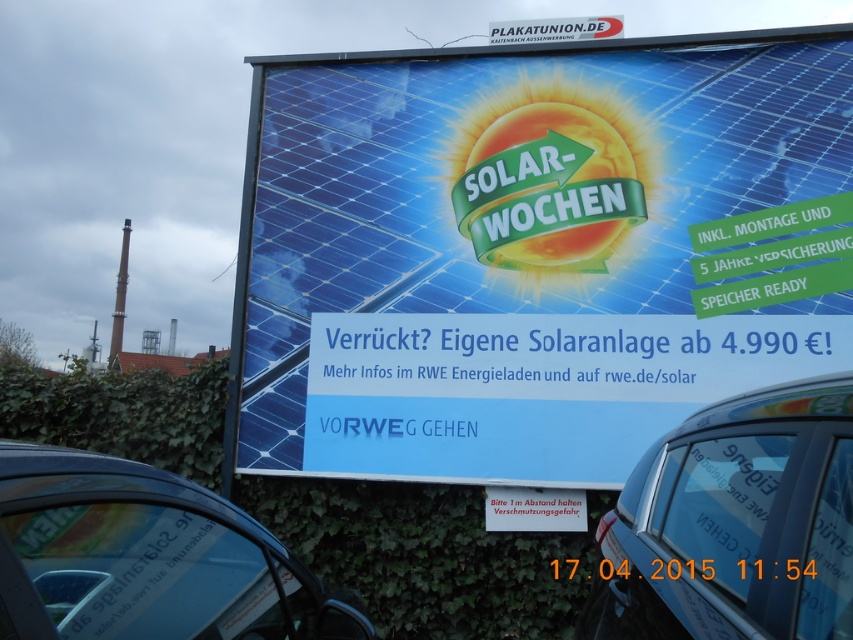
What is the spatial relationship between the blue metallic car at center and the white plastic sign at top in the image?

The blue metallic car at center is located below the white plastic sign at top.

You are a delivery driver who needs to park your metallic silver car at lower left near the billboard. The parking spot is marked by a white rectangle on the ground. The coordinates of the parking spot are at point (144, 557). Can you safely park your car in this spot without overlapping the billboard?

The point (144, 557) indicates the metallic silver car at lower left, so the parking spot is already occupied by the car. Therefore, you cannot park there without overlapping the car, which is already present at that location.